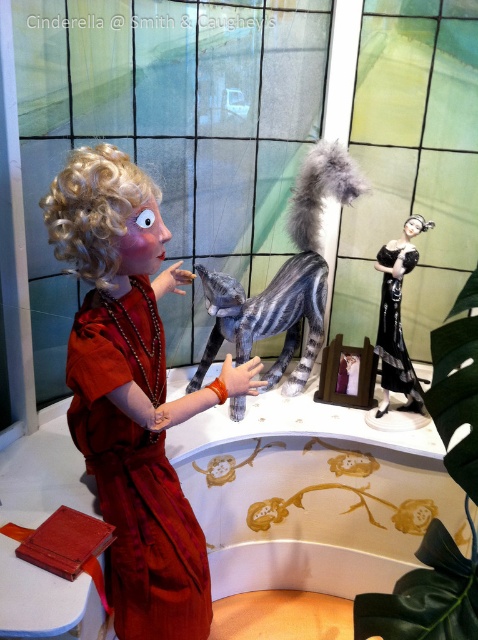
Question: Observing the image, what is the correct spatial positioning of striped fur cat at center in reference to black satin dress at center?

Choices:
 (A) above
 (B) below

Answer: (A)

Question: Where is satin dress at center located in relation to black satin dress at center in the image?

Choices:
 (A) below
 (B) above

Answer: (A)

Question: Which point is closer to the camera taking this photo?

Choices:
 (A) pos(107,346)
 (B) pos(121,532)
 (C) pos(399,326)

Answer: (A)

Question: Which point appears closest to the camera in this image?

Choices:
 (A) (299, 230)
 (B) (96, 374)
 (C) (113, 435)
 (D) (404, 244)

Answer: (B)

Question: Is matte red dress at center bigger than black satin dress at center?

Choices:
 (A) yes
 (B) no

Answer: (A)

Question: Which object is the closest to the matte red dress at center?

Choices:
 (A) satin dress at center
 (B) striped fur cat at center
 (C) black satin dress at center

Answer: (A)